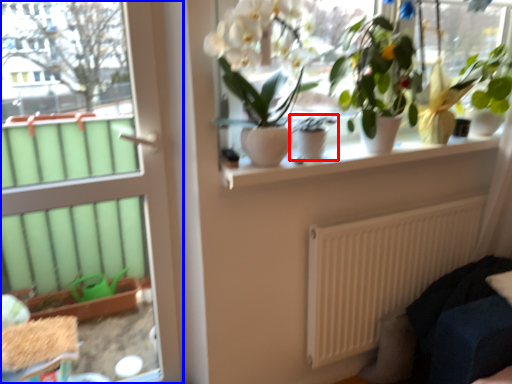
Question: Which object is further to the camera taking this photo, houseplant (highlighted by a red box) or door (highlighted by a blue box)?

Choices:
 (A) houseplant
 (B) door

Answer: (A)